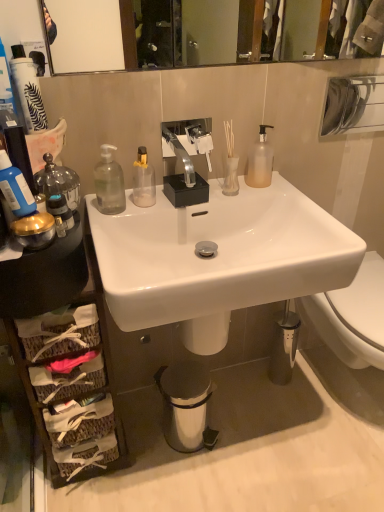
This screenshot has width=384, height=512. I want to click on free space to the right of woven wood basket at lower left, so click(x=156, y=456).